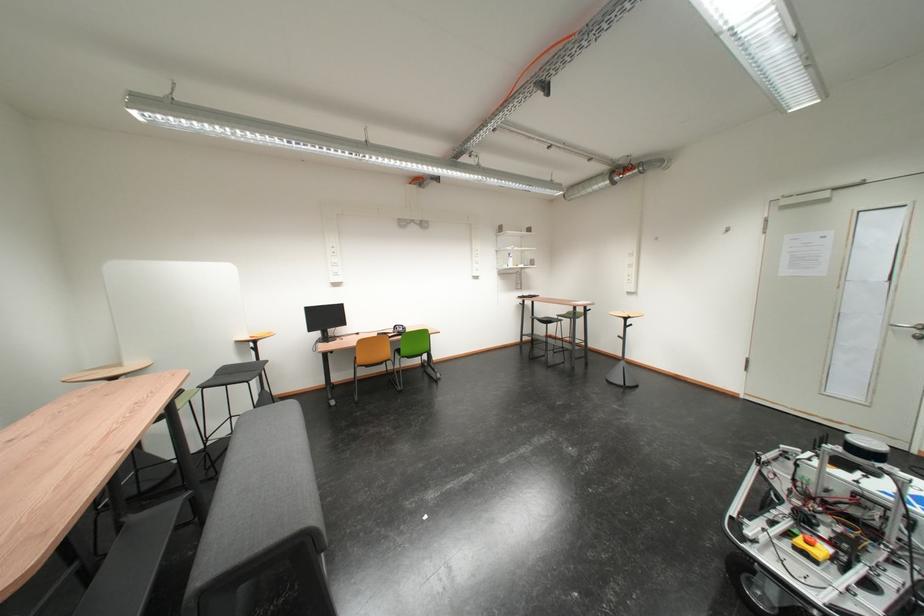
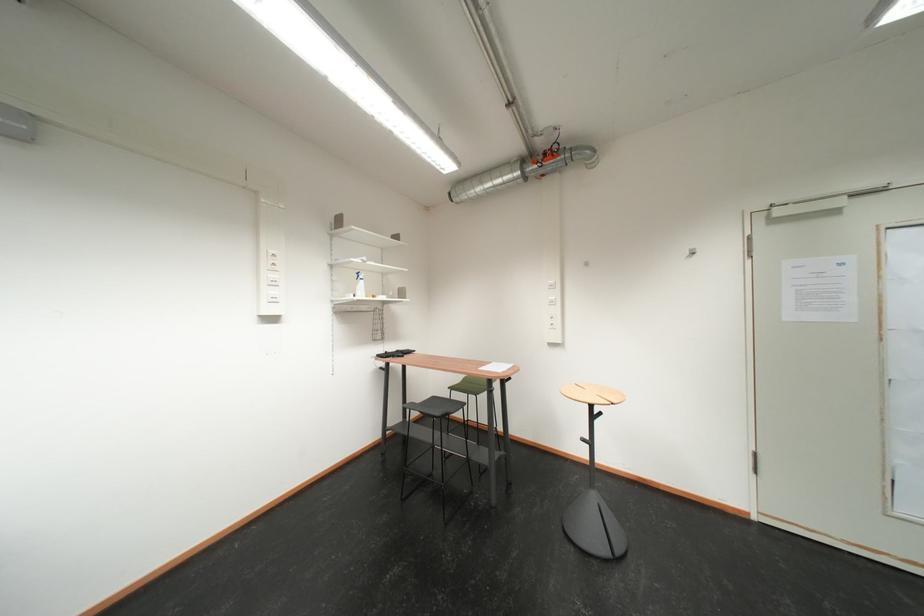
Locate, in the second image, the point that corresponds to (x=638, y=284) in the first image.

(562, 329)